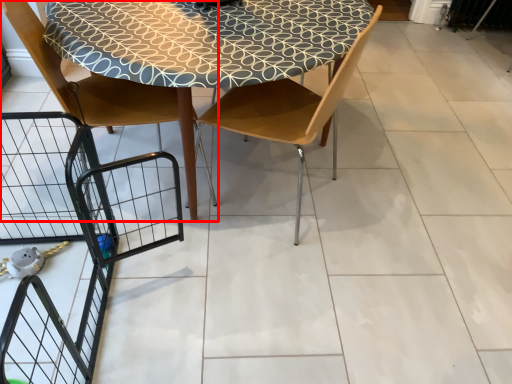
Question: Where is chair (annotated by the red box) located in relation to chair in the image?

Choices:
 (A) right
 (B) left

Answer: (B)